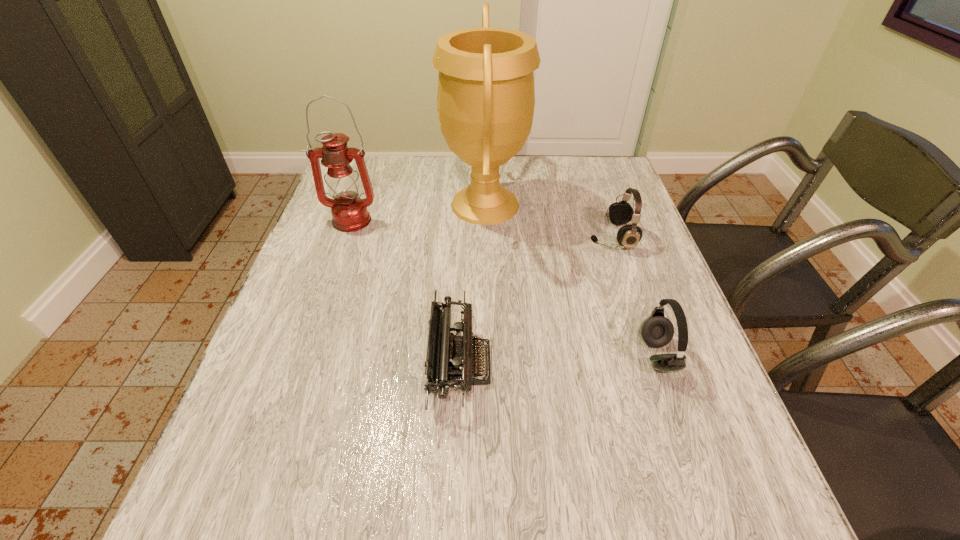
The height and width of the screenshot is (540, 960). Find the location of `free space that is in between the shortest object and the farther headset`. free space that is in between the shortest object and the farther headset is located at coordinates (536, 301).

At what (x,y) coordinates should I click in order to perform the action: click on free space between the trophy and the leftmost object. Please return your answer as a coordinate pair (x, y). Looking at the image, I should click on (418, 213).

Where is `free space between the shortest object and the tallest object`? This screenshot has height=540, width=960. free space between the shortest object and the tallest object is located at coordinates (472, 285).

The width and height of the screenshot is (960, 540). In order to click on free space between the farther headset and the tallest object in this screenshot , I will do `click(548, 221)`.

Locate an element on the screen. The height and width of the screenshot is (540, 960). empty space that is in between the oil lamp and the nearer headset is located at coordinates (504, 288).

I want to click on object that ranks as the closest to the second tallest object, so click(x=486, y=97).

At what (x,y) coordinates should I click in order to perform the action: click on object that can be found as the second closest to the oil lamp. Please return your answer as a coordinate pair (x, y). The width and height of the screenshot is (960, 540). Looking at the image, I should click on (449, 363).